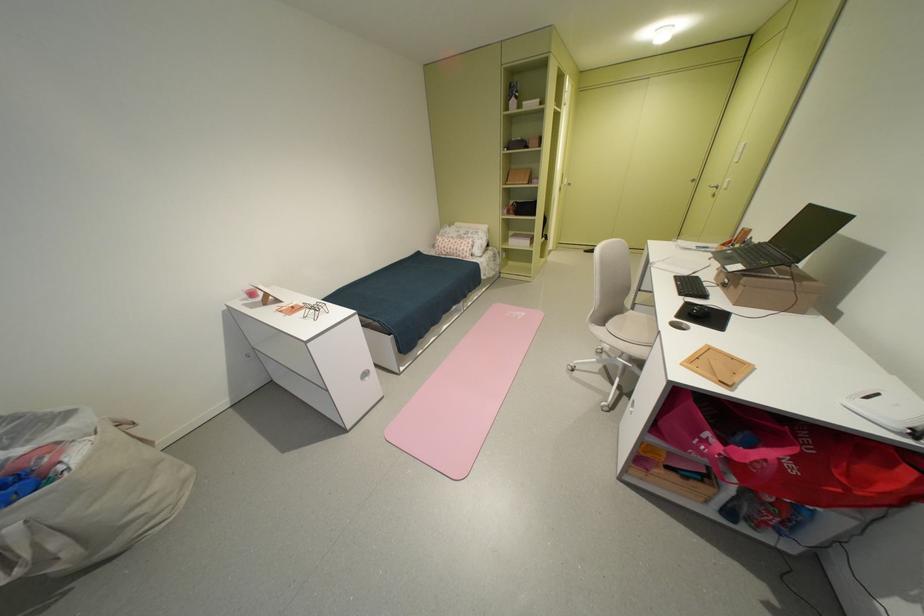
This screenshot has height=616, width=924. Describe the element at coordinates (718, 367) in the screenshot. I see `the wooden picture frame` at that location.